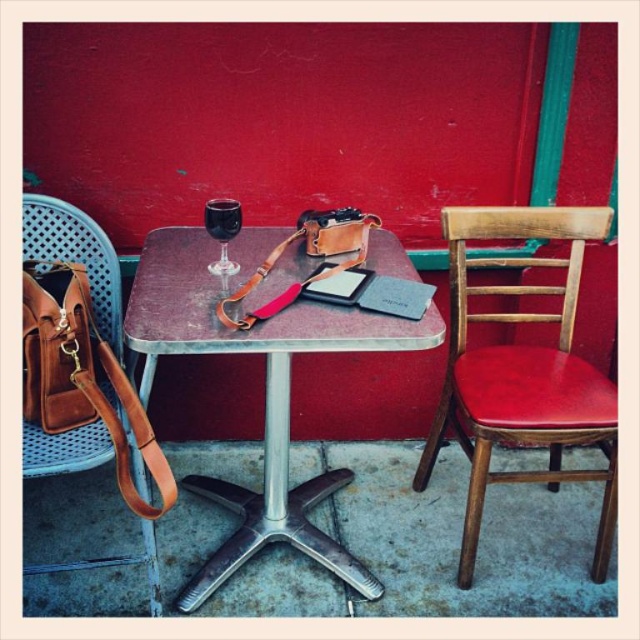
Question: Which object is the closest to the brown leather bag at left?

Choices:
 (A) transparent glass at center
 (B) brown leather strap at table

Answer: (A)

Question: Which object is the closest to the brown leather bag at left?

Choices:
 (A) brown leather strap at table
 (B) rustic wood table at center
 (C) transparent glass at center
 (D) wooden chair with red cushion at right

Answer: (B)

Question: Estimate the real-world distances between objects in this image. Which object is closer to the brown leather strap at table?

Choices:
 (A) transparent glass at center
 (B) wooden chair with red cushion at right
 (C) brown leather bag at left
 (D) rustic wood table at center

Answer: (A)

Question: Observing the image, what is the correct spatial positioning of brown leather strap at table in reference to transparent glass at center?

Choices:
 (A) right
 (B) left

Answer: (A)

Question: Can you confirm if wooden chair with red cushion at right is positioned to the right of brown leather bag at left?

Choices:
 (A) no
 (B) yes

Answer: (B)

Question: Does rustic wood table at center have a larger size compared to brown leather bag at left?

Choices:
 (A) yes
 (B) no

Answer: (A)